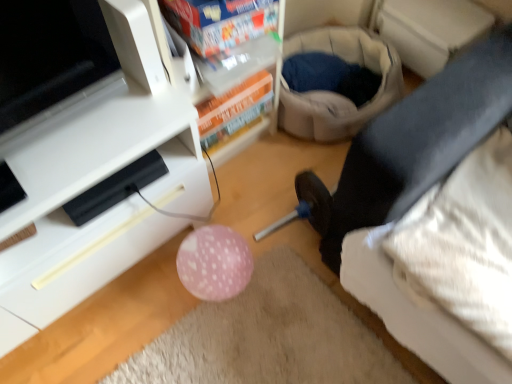
Question: Considering the relative positions of white glossy tv stand at lower left and white plastic shelf at upper center in the image provided, is white glossy tv stand at lower left to the left of white plastic shelf at upper center from the viewer's perspective?

Choices:
 (A) yes
 (B) no

Answer: (A)

Question: Can you confirm if white glossy tv stand at lower left is smaller than white plastic shelf at upper center?

Choices:
 (A) yes
 (B) no

Answer: (B)

Question: Is white glossy tv stand at lower left looking in the opposite direction of white plastic shelf at upper center?

Choices:
 (A) yes
 (B) no

Answer: (B)

Question: Considering the relative positions of white glossy tv stand at lower left and white plastic shelf at upper center in the image provided, is white glossy tv stand at lower left to the right of white plastic shelf at upper center from the viewer's perspective?

Choices:
 (A) no
 (B) yes

Answer: (A)

Question: Is the depth of white glossy tv stand at lower left greater than that of white plastic shelf at upper center?

Choices:
 (A) no
 (B) yes

Answer: (A)

Question: From their relative heights in the image, would you say white glossy tv stand at lower left is taller or shorter than black fabric leg at lower right?

Choices:
 (A) tall
 (B) short

Answer: (A)

Question: Is point (96, 110) positioned closer to the camera than point (442, 152)?

Choices:
 (A) closer
 (B) farther

Answer: (B)

Question: In terms of size, does white glossy tv stand at lower left appear bigger or smaller than black fabric leg at lower right?

Choices:
 (A) small
 (B) big

Answer: (B)

Question: Considering the relative positions of white glossy tv stand at lower left and black fabric leg at lower right in the image provided, is white glossy tv stand at lower left to the left or to the right of black fabric leg at lower right?

Choices:
 (A) right
 (B) left

Answer: (B)

Question: Choose the correct answer: Is white glossy tv stand at lower left inside white plastic shelf at upper center or outside it?

Choices:
 (A) outside
 (B) inside

Answer: (A)

Question: From a real-world perspective, is white glossy tv stand at lower left positioned above or below white plastic shelf at upper center?

Choices:
 (A) above
 (B) below

Answer: (B)

Question: Considering their positions, is white glossy tv stand at lower left located in front of or behind white plastic shelf at upper center?

Choices:
 (A) behind
 (B) front

Answer: (B)

Question: In terms of size, does white glossy tv stand at lower left appear bigger or smaller than white plastic shelf at upper center?

Choices:
 (A) small
 (B) big

Answer: (B)

Question: Relative to white glossy tv stand at lower left, is black fabric leg at lower right in front or behind?

Choices:
 (A) behind
 (B) front

Answer: (A)

Question: From a real-world perspective, relative to white glossy tv stand at lower left, is black fabric leg at lower right vertically above or below?

Choices:
 (A) below
 (B) above

Answer: (A)